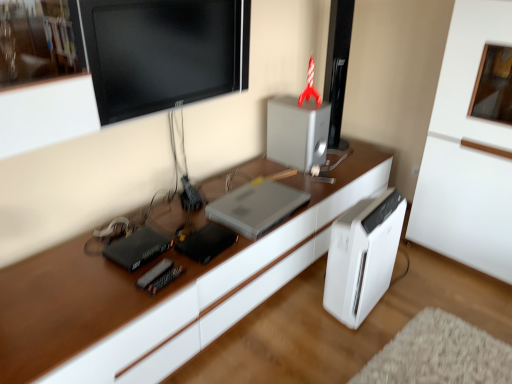
You are a GUI agent. You are given a task and a screenshot of the screen. Output one action in this format:
    pyautogui.click(x=<x>, y=<y>)
    Task: Click on the white glossy desk at center
    Image resolution: width=512 pixels, height=384 pixels.
    Given the screenshot: What is the action you would take?
    pyautogui.click(x=161, y=290)

What do you see at coordinates (256, 207) in the screenshot? This screenshot has width=512, height=384. I see `satin silver laptop at center` at bounding box center [256, 207].

Locate an element on the screen. satin silver laptop at center is located at coordinates (256, 207).

Image resolution: width=512 pixels, height=384 pixels. In order to click on satin silver speaker at upper center, which ranks as the 2th appliance in front-to-back order in this screenshot , I will do `click(297, 132)`.

Where is `white plastic air purifier at lower right`? This screenshot has height=384, width=512. white plastic air purifier at lower right is located at coordinates tap(362, 256).

What is the approximate width of white plastic air purifier at lower right?

The width of white plastic air purifier at lower right is 8.25 inches.

At what (x,y) coordinates should I click in order to perform the action: click on white glossy desk at center. Please return your answer as a coordinate pair (x, y). Image resolution: width=512 pixels, height=384 pixels. Looking at the image, I should click on (161, 290).

Is satin silver speaker at upper center, the 2th appliance when ordered from bottom to top, to the left of satin silver laptop at center from the viewer's perspective?

No.

From a real-world perspective, is satin silver speaker at upper center, which ranks as the second appliance in left-to-right order, physically below satin silver laptop at center?

No.

Looking at this image, from their relative heights in the image, would you say satin silver speaker at upper center, which ranks as the first appliance in top-to-bottom order, is taller or shorter than satin silver laptop at center?

In the image, satin silver speaker at upper center, which ranks as the first appliance in top-to-bottom order, appears to be taller than satin silver laptop at center.

Which of these two, satin silver laptop at center or white glossy desk at center, stands shorter?

Standing shorter between the two is white glossy desk at center.

Measure the distance from satin silver laptop at center to white glossy desk at center.

satin silver laptop at center and white glossy desk at center are 11.02 inches apart from each other.

Looking at their sizes, would you say satin silver laptop at center is wider or thinner than white glossy desk at center?

Considering their sizes, satin silver laptop at center looks slimmer than white glossy desk at center.

Is satin silver laptop at center turned away from white glossy desk at center?

No, satin silver laptop at center's orientation is not away from white glossy desk at center.

Is black glossy monitor at upper center surrounding satin silver speaker at upper center, which ranks as the first appliance in top-to-bottom order?

No, satin silver speaker at upper center, which ranks as the first appliance in top-to-bottom order, is located outside of black glossy monitor at upper center.

Is the position of black glossy monitor at upper center less distant than that of satin silver speaker at upper center, placed as the 1th appliance when sorted from back to front?

Yes, it is.

Is black glossy monitor at upper center at the right side of satin silver speaker at upper center, placed as the 1th appliance when sorted from back to front?

No, black glossy monitor at upper center is not to the right of satin silver speaker at upper center, placed as the 1th appliance when sorted from back to front.

Considering the relative sizes of white plastic air purifier at lower right and satin silver laptop at center in the image provided, is white plastic air purifier at lower right smaller than satin silver laptop at center?

No, white plastic air purifier at lower right is not smaller than satin silver laptop at center.

Which object is positioned more to the left, white plastic air purifier at lower right or satin silver laptop at center?

satin silver laptop at center.

Is white plastic air purifier at lower right positioned before satin silver laptop at center?

That is True.

Which of these two, white plastic air purifier at lower right or satin silver laptop at center, stands taller?

white plastic air purifier at lower right.

Which is in front, point (113, 63) or point (223, 212)?

The point (113, 63) is in front.

Is black glossy monitor at upper center directly adjacent to satin silver laptop at center?

No, black glossy monitor at upper center is not with satin silver laptop at center.

Is black glossy monitor at upper center taller or shorter than satin silver laptop at center?

In the image, black glossy monitor at upper center appears to be taller than satin silver laptop at center.

Is black plastic router at left, which is counted as the first appliance, starting from the left, closer to camera compared to black glossy monitor at upper center?

No.

Is point (118, 240) positioned in front of point (232, 50)?

That is True.

How much distance is there between black plastic router at left, positioned as the 1th appliance in front-to-back order, and black glossy monitor at upper center?

29.28 inches.

Can you confirm if white plastic air purifier at lower right is bigger than satin silver speaker at upper center, placed as the first appliance when sorted from right to left?

Yes.

From the image's perspective, which one is positioned lower, white plastic air purifier at lower right or satin silver speaker at upper center, which ranks as the 2th appliance in front-to-back order?

white plastic air purifier at lower right appears lower in the image.

Which point is more forward, (338, 237) or (287, 100)?

The point (338, 237) is closer.

From the picture: Is white plastic air purifier at lower right positioned in front of satin silver speaker at upper center, which ranks as the second appliance in left-to-right order?

Yes, white plastic air purifier at lower right is in front of satin silver speaker at upper center, which ranks as the second appliance in left-to-right order.

Where is `appliance positioned vertically above the satin silver laptop at center (from a real-world perspective)`? The height and width of the screenshot is (384, 512). appliance positioned vertically above the satin silver laptop at center (from a real-world perspective) is located at coordinates (297, 132).

At what (x,y) coordinates should I click in order to perform the action: click on desk below the satin silver laptop at center (from a real-world perspective). Please return your answer as a coordinate pair (x, y). The height and width of the screenshot is (384, 512). Looking at the image, I should click on (161, 290).

Based on their spatial positions, is white plastic air purifier at lower right or black plastic router at left, placed as the 2th appliance when sorted from back to front, further from satin silver speaker at upper center, which ranks as the 2th appliance in front-to-back order?

black plastic router at left, placed as the 2th appliance when sorted from back to front, lies further to satin silver speaker at upper center, which ranks as the 2th appliance in front-to-back order, than the other object.

When comparing their distances from white glossy desk at center, does black glossy monitor at upper center or black plastic router at left, which is counted as the first appliance, starting from the left, seem closer?

Among the two, black plastic router at left, which is counted as the first appliance, starting from the left, is located nearer to white glossy desk at center.

Estimate the real-world distances between objects in this image. Which object is closer to white plastic air purifier at lower right, satin silver speaker at upper center, the 2th appliance when ordered from bottom to top, or white glossy desk at center?

white glossy desk at center.

Estimate the real-world distances between objects in this image. Which object is closer to satin silver speaker at upper center, placed as the first appliance when sorted from right to left, satin silver laptop at center or white plastic air purifier at lower right?

satin silver laptop at center is closer to satin silver speaker at upper center, placed as the first appliance when sorted from right to left.

From the image, which object appears to be farther from black plastic router at left, the 1th appliance from the bottom, white plastic air purifier at lower right or satin silver speaker at upper center, which ranks as the second appliance in left-to-right order?

satin silver speaker at upper center, which ranks as the second appliance in left-to-right order, lies further to black plastic router at left, the 1th appliance from the bottom, than the other object.

From the image, which object appears to be nearer to black plastic router at left, which is the 2th appliance in top-to-bottom order, satin silver speaker at upper center, the 2th appliance when ordered from bottom to top, or white plastic air purifier at lower right?

Among the two, white plastic air purifier at lower right is located nearer to black plastic router at left, which is the 2th appliance in top-to-bottom order.

Considering their positions, is black plastic router at left, placed as the 2th appliance when sorted from back to front, positioned closer to satin silver laptop at center than white plastic air purifier at lower right?

white plastic air purifier at lower right lies closer to satin silver laptop at center than the other object.

Based on their spatial positions, is black plastic router at left, which is the 2th appliance in top-to-bottom order, or white glossy desk at center further from black glossy monitor at upper center?

Based on the image, black plastic router at left, which is the 2th appliance in top-to-bottom order, appears to be further to black glossy monitor at upper center.

The image size is (512, 384). I want to click on computer between black glossy monitor at upper center and satin silver speaker at upper center, placed as the 1th appliance when sorted from back to front, from front to back, so click(x=256, y=207).

Image resolution: width=512 pixels, height=384 pixels. I want to click on computer located between white glossy desk at center and satin silver speaker at upper center, the 2th appliance when ordered from bottom to top, in the depth direction, so click(x=256, y=207).

Locate an element on the screen. This screenshot has height=384, width=512. appliance between black glossy monitor at upper center and black plastic router at left, which is counted as the first appliance, starting from the left, in the vertical direction is located at coordinates (297, 132).

You are a GUI agent. You are given a task and a screenshot of the screen. Output one action in this format:
    pyautogui.click(x=<x>, y=<y>)
    Task: Click on the appliance located between black plastic router at left, which is the 2th appliance in top-to-bottom order, and white plastic air purifier at lower right in the left-right direction
    Image resolution: width=512 pixels, height=384 pixels.
    Given the screenshot: What is the action you would take?
    pyautogui.click(x=297, y=132)